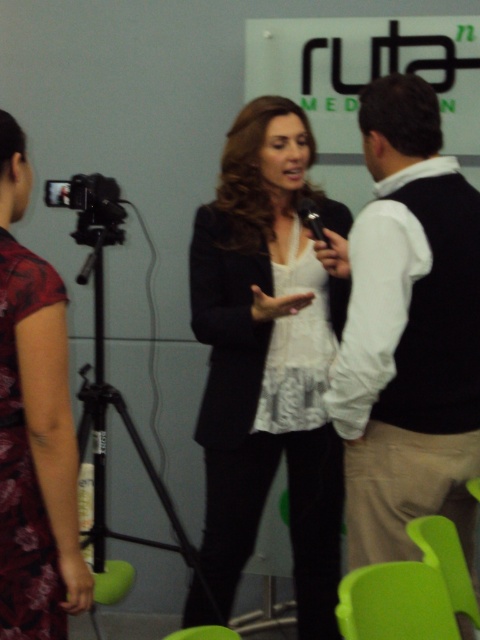
Question: Does black sweater at center come behind white matte blazer at center?

Choices:
 (A) no
 (B) yes

Answer: (A)

Question: Can you confirm if white matte blazer at center is smaller than floral silk dress at left?

Choices:
 (A) yes
 (B) no

Answer: (B)

Question: Which object is closer to the camera taking this photo?

Choices:
 (A) black sweater at center
 (B) white matte blazer at center

Answer: (A)

Question: Which point is closer to the camera?

Choices:
 (A) white matte blazer at center
 (B) floral silk dress at left

Answer: (B)

Question: Is black sweater at center positioned behind white matte blazer at center?

Choices:
 (A) no
 (B) yes

Answer: (A)

Question: Considering the real-world distances, which object is farthest from the floral silk dress at left?

Choices:
 (A) black sweater at center
 (B) white matte blazer at center

Answer: (A)